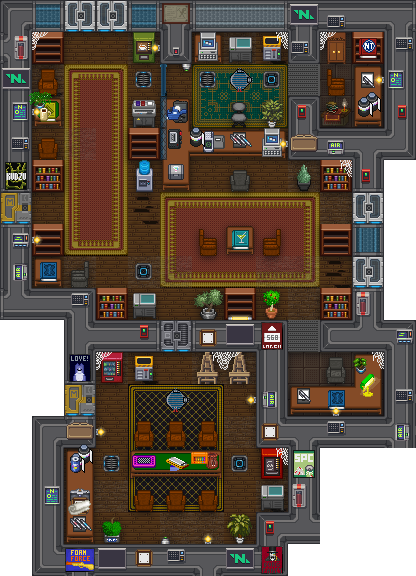
In order to click on rooms in this screenshot , I will do `click(149, 241)`, `click(245, 94)`, `click(342, 75)`, `click(326, 372)`, `click(196, 483)`.